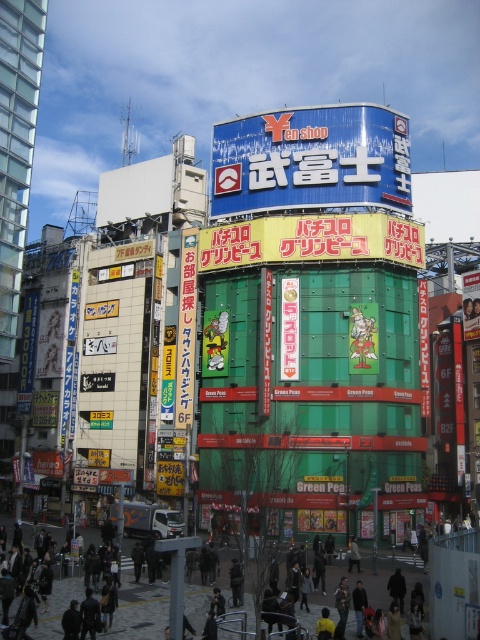
Who is higher up, dark gray jacket at center or yellow plastic sign at center?

yellow plastic sign at center is above.

What do you see at coordinates (139, 605) in the screenshot? This screenshot has height=640, width=480. I see `dark gray jacket at center` at bounding box center [139, 605].

Find the location of `dark gray jacket at center`. dark gray jacket at center is located at coordinates point(139,605).

Is blue glossy sign at upper center below yellow plastic sign at center?

No.

Is point (392, 161) positioned in front of point (288, 342)?

No, it is behind (288, 342).

This screenshot has height=640, width=480. I want to click on blue glossy sign at upper center, so click(311, 160).

Does blue glossy sign at upper center appear on the left side of dark gray jacket at center?

Incorrect, blue glossy sign at upper center is not on the left side of dark gray jacket at center.

Does point (226, 172) lie behind point (375, 593)?

Yes, point (226, 172) is farther from viewer.

At what (x,y) coordinates should I click in order to perform the action: click on blue glossy sign at upper center. Please return your answer as a coordinate pair (x, y). Looking at the image, I should click on (311, 160).